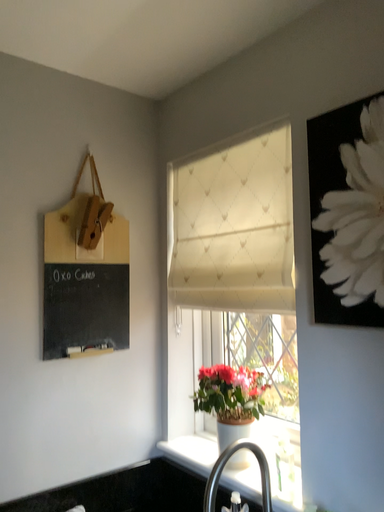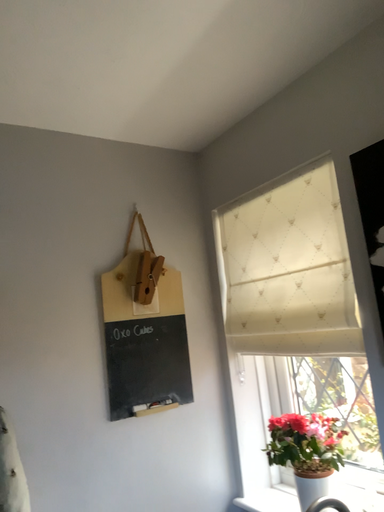
Question: How did the camera likely rotate when shooting the video?

Choices:
 (A) rotated left
 (B) rotated right

Answer: (A)